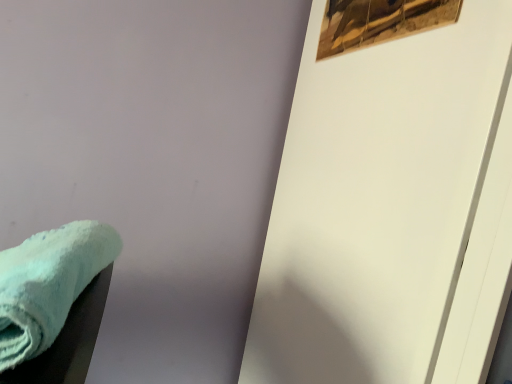
Question: Should I look upward or downward to see wooden frame at upper right?

Choices:
 (A) up
 (B) down

Answer: (A)

Question: From a real-world perspective, is soft teal towel at lower left over wooden frame at upper right?

Choices:
 (A) no
 (B) yes

Answer: (A)

Question: Is soft teal towel at lower left facing away from wooden frame at upper right?

Choices:
 (A) no
 (B) yes

Answer: (A)

Question: Considering the relative sizes of soft teal towel at lower left and wooden frame at upper right in the image provided, is soft teal towel at lower left thinner than wooden frame at upper right?

Choices:
 (A) yes
 (B) no

Answer: (B)

Question: Can you confirm if soft teal towel at lower left is shorter than wooden frame at upper right?

Choices:
 (A) yes
 (B) no

Answer: (B)

Question: From the image's perspective, is soft teal towel at lower left under wooden frame at upper right?

Choices:
 (A) no
 (B) yes

Answer: (B)

Question: Is soft teal towel at lower left in contact with wooden frame at upper right?

Choices:
 (A) no
 (B) yes

Answer: (A)

Question: Considering the relative sizes of wooden frame at upper right and soft teal towel at lower left in the image provided, is wooden frame at upper right smaller than soft teal towel at lower left?

Choices:
 (A) no
 (B) yes

Answer: (B)

Question: Is wooden frame at upper right looking in the opposite direction of soft teal towel at lower left?

Choices:
 (A) yes
 (B) no

Answer: (B)

Question: Does wooden frame at upper right appear on the right side of soft teal towel at lower left?

Choices:
 (A) yes
 (B) no

Answer: (A)

Question: From the image's perspective, is wooden frame at upper right under soft teal towel at lower left?

Choices:
 (A) yes
 (B) no

Answer: (B)

Question: Is wooden frame at upper right behind soft teal towel at lower left?

Choices:
 (A) yes
 (B) no

Answer: (A)

Question: Can you confirm if wooden frame at upper right is positioned to the left of soft teal towel at lower left?

Choices:
 (A) yes
 (B) no

Answer: (B)

Question: In terms of size, does wooden frame at upper right appear bigger or smaller than soft teal towel at lower left?

Choices:
 (A) big
 (B) small

Answer: (B)